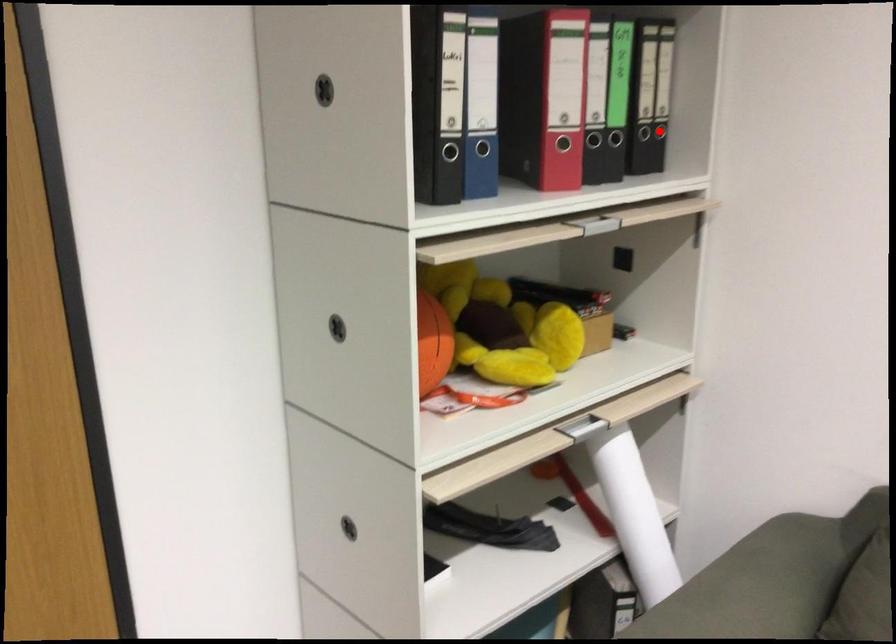
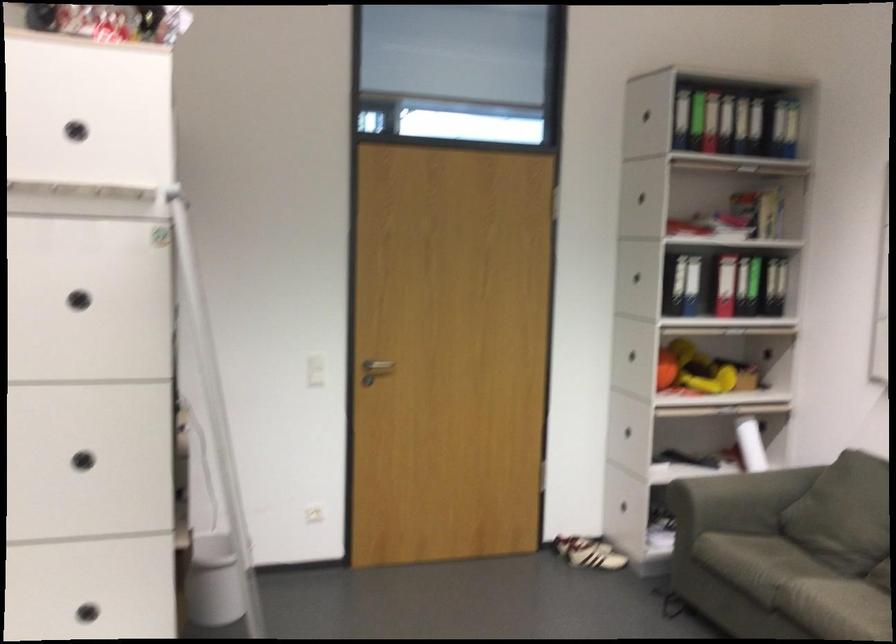
Question: I am providing you with two images of the same scene from different viewpoints. A red point is shown in image1. For the corresponding object point in image2, is it positioned nearer or farther from the camera?

Choices:
 (A) Nearer
 (B) Farther

Answer: (B)